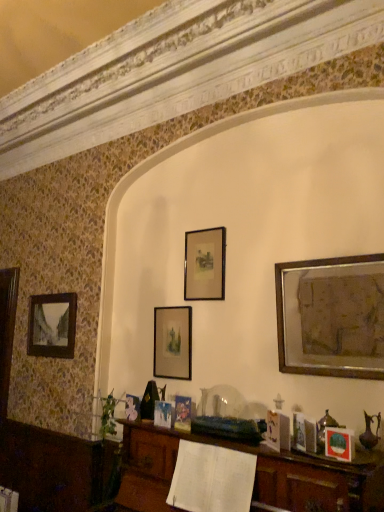
Question: Can you confirm if matte black picture frame at lower right, the fourth picture frame in the left-to-right sequence, is taller than matte black picture frame at center, which ranks as the third picture frame in left-to-right order?

Choices:
 (A) yes
 (B) no

Answer: (B)

Question: Does matte black picture frame at lower right, the second picture frame in the right-to-left sequence, turn towards matte black picture frame at center, which ranks as the third picture frame in front-to-back order?

Choices:
 (A) no
 (B) yes

Answer: (A)

Question: From the image's perspective, is matte black picture frame at lower right, which appears as the first picture frame when viewed from the front, located above matte black picture frame at center, the third picture frame in the back-to-front sequence?

Choices:
 (A) yes
 (B) no

Answer: (B)

Question: Can you confirm if matte black picture frame at lower right, the second picture frame in the right-to-left sequence, is shorter than matte black picture frame at center, the third picture frame in the back-to-front sequence?

Choices:
 (A) no
 (B) yes

Answer: (B)

Question: From a real-world perspective, is matte black picture frame at lower right, the fourth picture frame in the left-to-right sequence, located beneath matte black picture frame at center, which ranks as the third picture frame in left-to-right order?

Choices:
 (A) yes
 (B) no

Answer: (A)

Question: Is matte black picture frame at lower right, marked as the fifth picture frame in a back-to-front arrangement, beside matte black picture frame at center, which ranks as the third picture frame in front-to-back order?

Choices:
 (A) no
 (B) yes

Answer: (A)

Question: Considering the relative sizes of matte black picture frame at center, marked as the 4th picture frame in a right-to-left arrangement, and gold metallic picture frame at upper right, positioned as the 1th picture frame in right-to-left order, in the image provided, is matte black picture frame at center, marked as the 4th picture frame in a right-to-left arrangement, taller than gold metallic picture frame at upper right, positioned as the 1th picture frame in right-to-left order,?

Choices:
 (A) yes
 (B) no

Answer: (B)

Question: Does matte black picture frame at center, which is counted as the fourth picture frame, starting from the front, have a lesser height compared to gold metallic picture frame at upper right, the second picture frame in the front-to-back sequence?

Choices:
 (A) no
 (B) yes

Answer: (B)

Question: From the image's perspective, is matte black picture frame at center, marked as the 4th picture frame in a right-to-left arrangement, below gold metallic picture frame at upper right, which is counted as the fourth picture frame, starting from the back?

Choices:
 (A) no
 (B) yes

Answer: (B)

Question: Is matte black picture frame at center, which is counted as the fourth picture frame, starting from the front, oriented away from gold metallic picture frame at upper right, positioned as the 1th picture frame in right-to-left order?

Choices:
 (A) yes
 (B) no

Answer: (B)

Question: Does matte black picture frame at center, which is the 2th picture frame from back to front, have a greater width compared to gold metallic picture frame at upper right, which is counted as the fourth picture frame, starting from the back?

Choices:
 (A) yes
 (B) no

Answer: (B)

Question: Are matte black picture frame at center, which is counted as the fourth picture frame, starting from the front, and gold metallic picture frame at upper right, which is counted as the fourth picture frame, starting from the back, beside each other?

Choices:
 (A) no
 (B) yes

Answer: (A)

Question: Considering the relative sizes of gold metallic picture frame at upper right, positioned as the 1th picture frame in right-to-left order, and matte black picture frame at lower right, the fourth picture frame in the left-to-right sequence, in the image provided, is gold metallic picture frame at upper right, positioned as the 1th picture frame in right-to-left order, thinner than matte black picture frame at lower right, the fourth picture frame in the left-to-right sequence,?

Choices:
 (A) yes
 (B) no

Answer: (B)